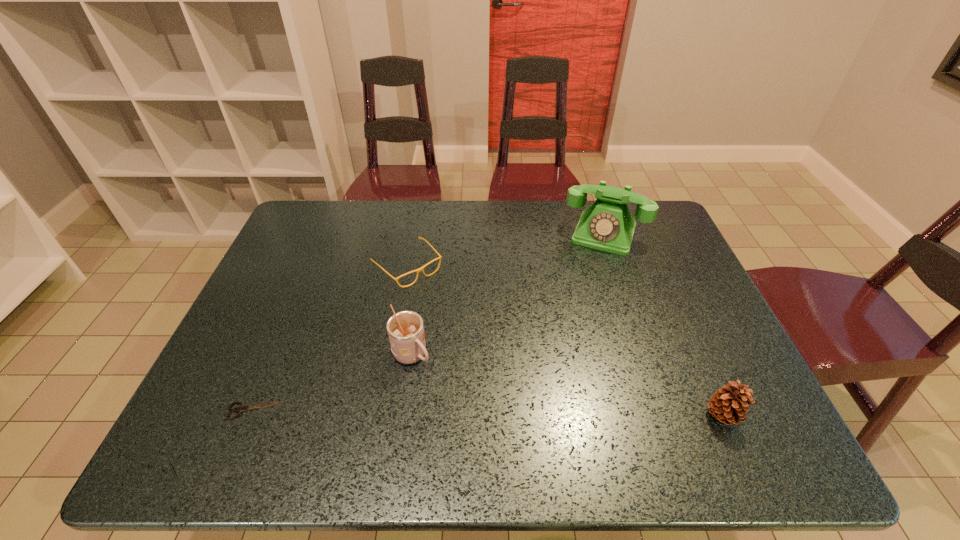
You are a GUI agent. You are given a task and a screenshot of the screen. Output one action in this format:
    pyautogui.click(x=<x>, y=<y>)
    Task: Click on the pinecone situated at the right edge
    The width and height of the screenshot is (960, 540).
    Given the screenshot: What is the action you would take?
    pyautogui.click(x=729, y=405)

In order to click on telephone located in the right edge section of the desktop in this screenshot , I will do `click(607, 225)`.

You are a GUI agent. You are given a task and a screenshot of the screen. Output one action in this format:
    pyautogui.click(x=<x>, y=<y>)
    Task: Click on the object present at the near left corner
    Image resolution: width=960 pixels, height=540 pixels.
    Given the screenshot: What is the action you would take?
    pyautogui.click(x=240, y=409)

Locate an element on the screen. This screenshot has height=540, width=960. object that is at the far right corner is located at coordinates (607, 225).

Where is `object that is at the near right corner`? The image size is (960, 540). object that is at the near right corner is located at coordinates (729, 405).

Where is `free space at the far edge of the desktop`? This screenshot has height=540, width=960. free space at the far edge of the desktop is located at coordinates (563, 227).

Identify the location of vacant space at the near edge of the desktop. Image resolution: width=960 pixels, height=540 pixels. (528, 397).

In the image, there is a desktop. Where is `vacant space at the left edge`? The height and width of the screenshot is (540, 960). vacant space at the left edge is located at coordinates [x=291, y=356].

At what (x,y) coordinates should I click in order to perform the action: click on free space at the right edge. Please return your answer as a coordinate pair (x, y). The image size is (960, 540). Looking at the image, I should click on (679, 369).

The height and width of the screenshot is (540, 960). What are the coordinates of `vacant space at the far left corner of the desktop` in the screenshot? It's located at pyautogui.click(x=318, y=241).